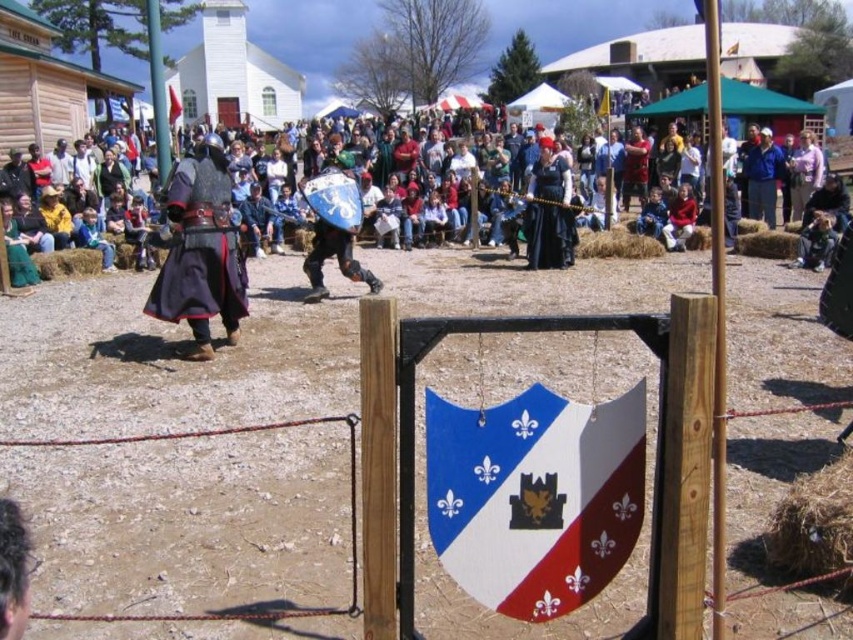
Which is behind, point (759, 472) or point (556, 193)?

Positioned behind is point (556, 193).

Between dirt field at center and black velvet dress at center, which one is positioned lower?

dirt field at center is below.

Which is behind, point (61, 604) or point (552, 205)?

The point (552, 205) is more distant.

The image size is (853, 640). I want to click on dirt field at center, so click(434, 444).

Looking at this image, does dark clothing at center come in front of red fabric flag at upper center?

Yes, dark clothing at center is closer to the viewer.

Is dark clothing at center smaller than red fabric flag at upper center?

No, dark clothing at center is not smaller than red fabric flag at upper center.

Measure the distance between point (625, 256) and camera.

Point (625, 256) and camera are 41.60 feet apart.

The height and width of the screenshot is (640, 853). What are the coordinates of `dark clothing at center` in the screenshot? It's located at (70, 260).

Can you confirm if wooden shield at center is wider than red fabric flag at upper center?

Correct, the width of wooden shield at center exceeds that of red fabric flag at upper center.

Does wooden shield at center have a lesser height compared to red fabric flag at upper center?

No, wooden shield at center is not shorter than red fabric flag at upper center.

Which is in front, point (575, 563) or point (171, 115)?

Point (575, 563) is in front.

This screenshot has width=853, height=640. Find the location of `wooden shield at center`. wooden shield at center is located at coordinates (534, 497).